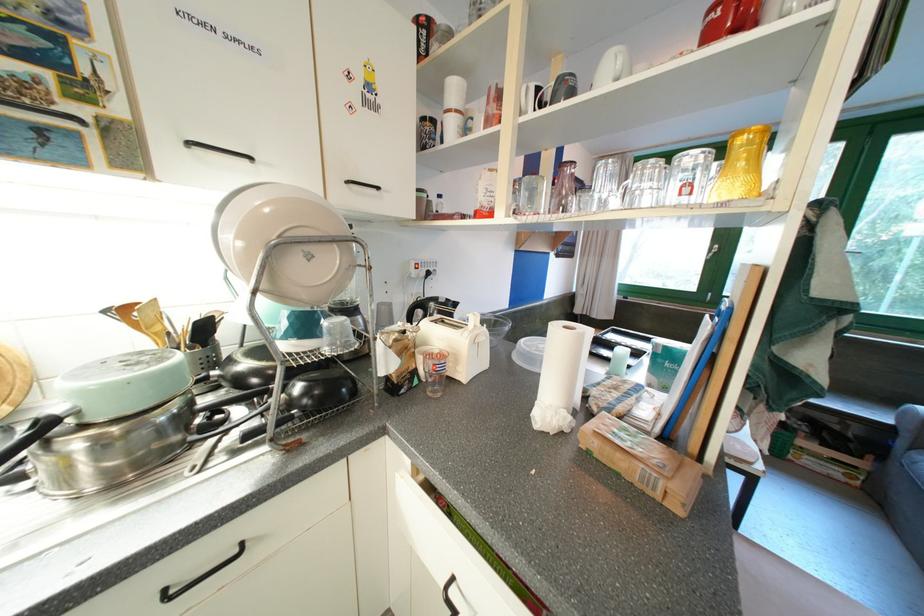
Where would you turn the green window handle? Please return your answer as a coordinate pair (x, y).

(853, 253)